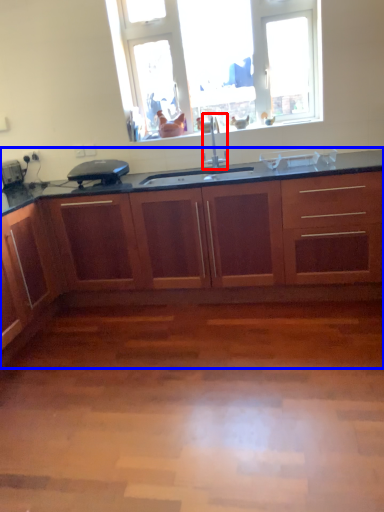
Question: Which of the following is the farthest to the observer, faucet (highlighted by a red box) or cabinetry (highlighted by a blue box)?

Choices:
 (A) faucet
 (B) cabinetry

Answer: (A)